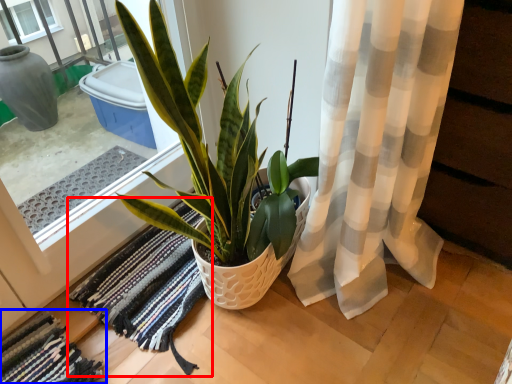
Question: Which object is closer to the camera taking this photo, bath mat (highlighted by a red box) or bath mat (highlighted by a blue box)?

Choices:
 (A) bath mat
 (B) bath mat

Answer: (B)